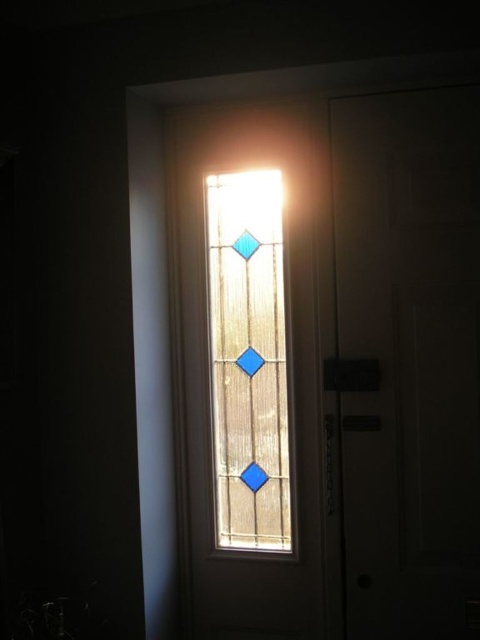
Question: Does white matte door at right appear over translucent stained glass at center?

Choices:
 (A) yes
 (B) no

Answer: (B)

Question: Can you confirm if white matte door at right is thinner than translucent stained glass at center?

Choices:
 (A) no
 (B) yes

Answer: (A)

Question: Is white matte door at right positioned before translucent stained glass at center?

Choices:
 (A) yes
 (B) no

Answer: (A)

Question: Which point is closer to the camera taking this photo?

Choices:
 (A) (261, 419)
 (B) (408, 324)

Answer: (B)

Question: Which of the following is the farthest from the observer?

Choices:
 (A) (389, 598)
 (B) (235, 312)

Answer: (B)

Question: Which object appears closest to the camera in this image?

Choices:
 (A) white matte door at right
 (B) translucent stained glass at center

Answer: (A)